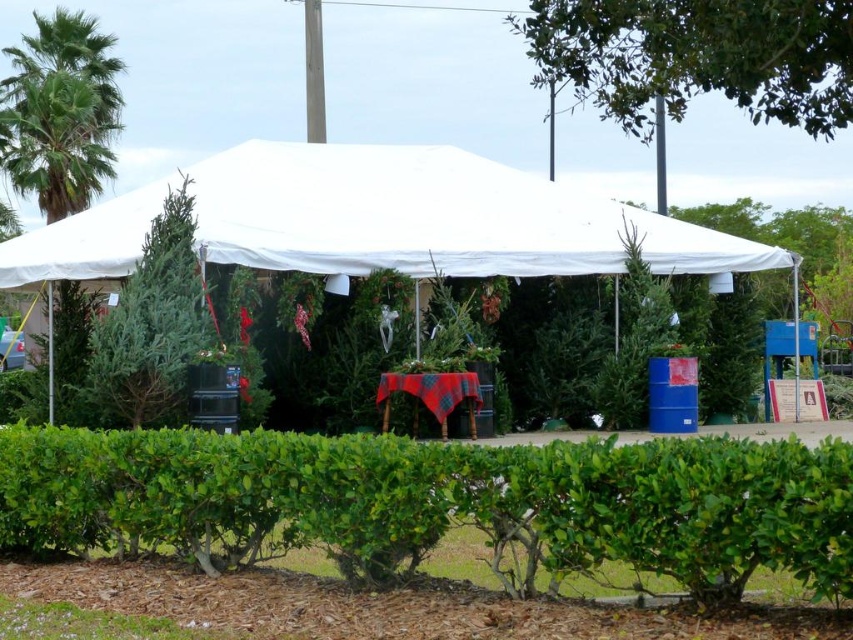
Is point (521, 525) positioned behind point (50, 132)?

No.

From the picture: Can you confirm if green leafy hedge at center is shorter than green leafy palm tree at upper left?

Yes.

Does point (325, 506) lie in front of point (68, 124)?

That is True.

At what (x,y) coordinates should I click in order to perform the action: click on green leafy hedge at center. Please return your answer as a coordinate pair (x, y). Image resolution: width=853 pixels, height=640 pixels. Looking at the image, I should click on (440, 500).

Can you confirm if white fabric tent at center is smaller than black plastic pole at upper right?

No, white fabric tent at center is not smaller than black plastic pole at upper right.

Who is more forward, (514, 172) or (659, 189)?

Point (514, 172)

Between point (267, 225) and point (657, 196), which one is positioned behind?

The point (657, 196) is more distant.

The width and height of the screenshot is (853, 640). In order to click on white fabric tent at center in this screenshot , I will do `click(379, 221)`.

Can you confirm if green leafy hedge at center is positioned below green leafy tree at upper center?

Indeed, green leafy hedge at center is positioned under green leafy tree at upper center.

Between point (711, 548) and point (822, 22), which one is positioned in front?

Positioned in front is point (711, 548).

Between point (386, 577) and point (721, 67), which one is positioned behind?

Positioned behind is point (386, 577).

What are the coordinates of `green leafy hedge at center` in the screenshot? It's located at (440, 500).